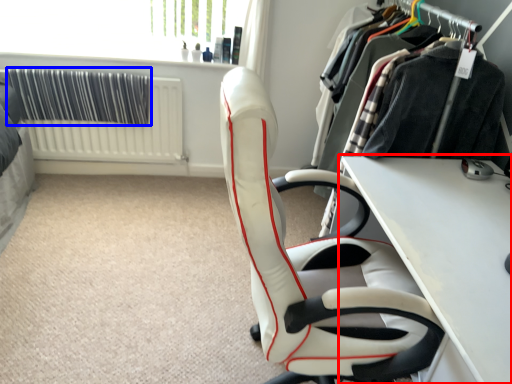
Question: Which of the following is the closest to the observer, table (highlighted by a red box) or curtain (highlighted by a blue box)?

Choices:
 (A) table
 (B) curtain

Answer: (A)